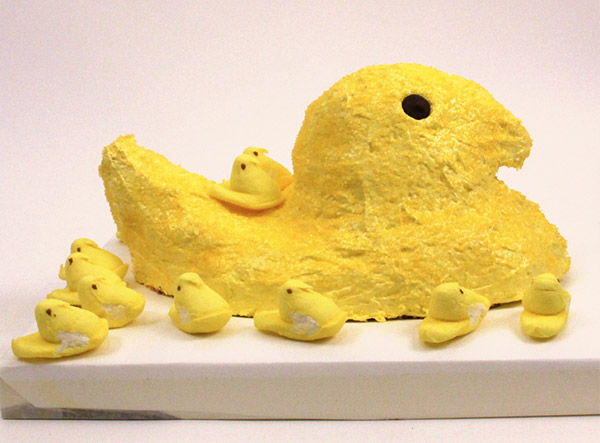
You are a GUI agent. You are given a task and a screenshot of the screen. Output one action in this format:
    pyautogui.click(x=<x>, y=<y>)
    Task: Click on the beige table
    The height and width of the screenshot is (443, 600).
    Given the screenshot: What is the action you would take?
    pyautogui.click(x=264, y=436)